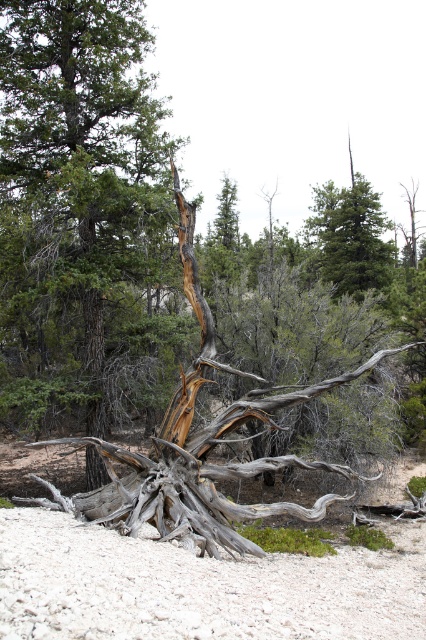
Question: Which point appears farthest from the camera in this image?

Choices:
 (A) (43, 116)
 (B) (118, 612)

Answer: (A)

Question: Does grayish-brown wood at center appear on the left side of white sandy ground at center?

Choices:
 (A) yes
 (B) no

Answer: (A)

Question: Can you confirm if grayish-brown wood at center is wider than white sandy ground at center?

Choices:
 (A) yes
 (B) no

Answer: (B)

Question: Which of the following is the closest to the observer?

Choices:
 (A) (86, 586)
 (B) (141, 358)

Answer: (A)

Question: Is grayish-brown wood at center further to camera compared to white sandy ground at center?

Choices:
 (A) yes
 (B) no

Answer: (A)